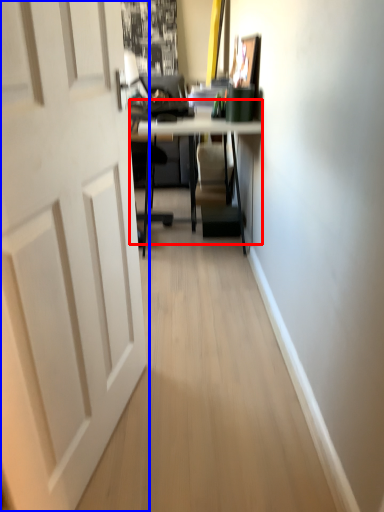
Question: Among these objects, which one is farthest to the camera, table (highlighted by a red box) or door (highlighted by a blue box)?

Choices:
 (A) table
 (B) door

Answer: (A)